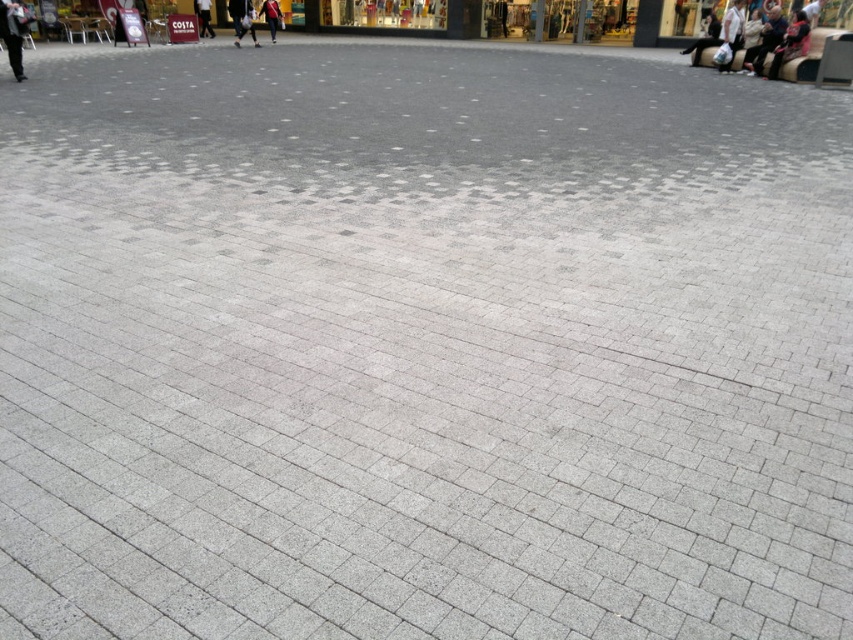
Question: Can you confirm if dark gray pants at left is bigger than light blue jeans at center?

Choices:
 (A) no
 (B) yes

Answer: (A)

Question: Based on their relative distances, which object is nearer to the dark gray pants at left?

Choices:
 (A) dark gray fabric jacket at center
 (B) dark blue jeans at upper right
 (C) light blue jeans at center
 (D) dark gray pants at center

Answer: (A)

Question: Considering the real-world distances, which object is closest to the dark gray fabric jacket at center?

Choices:
 (A) light blue jeans at center
 (B) dark gray pants at center

Answer: (B)

Question: Is dark gray pants at left thinner than light blue jeans at center?

Choices:
 (A) yes
 (B) no

Answer: (A)

Question: Which is farther from the dark blue jeans at upper right?

Choices:
 (A) dark gray pants at left
 (B) dark gray fabric jacket at center
 (C) light blue jeans at center

Answer: (A)

Question: Can you confirm if dark blue jeans at upper right is bigger than dark gray pants at center?

Choices:
 (A) yes
 (B) no

Answer: (A)